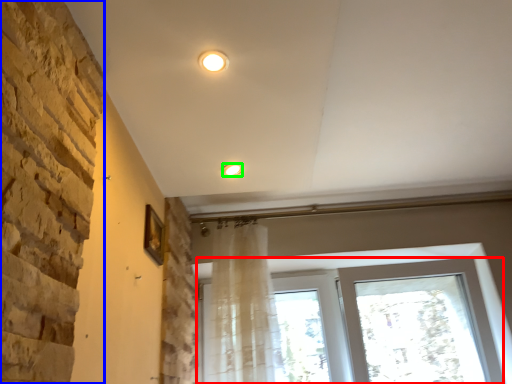
Question: Considering the real-world distances, which object is closest to window (highlighted by a red box)? brickwork (highlighted by a blue box) or lighting (highlighted by a green box).

Choices:
 (A) brickwork
 (B) lighting

Answer: (B)